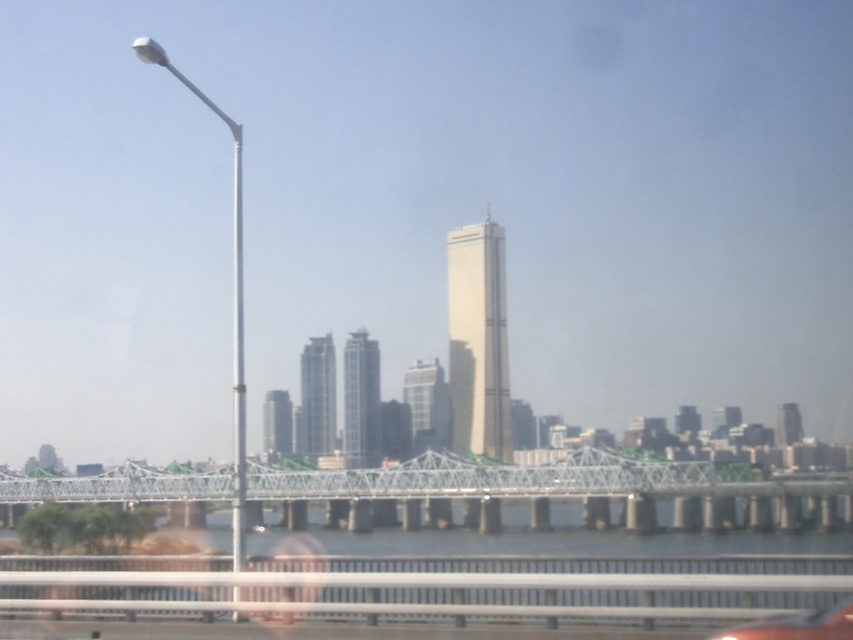
Can you confirm if metallic gray bridge at center is positioned to the left of metallic silver car at lower center?

Correct, you'll find metallic gray bridge at center to the left of metallic silver car at lower center.

Does point (93, 484) lie in front of point (814, 636)?

No.

The height and width of the screenshot is (640, 853). I want to click on metallic gray bridge at center, so click(x=525, y=481).